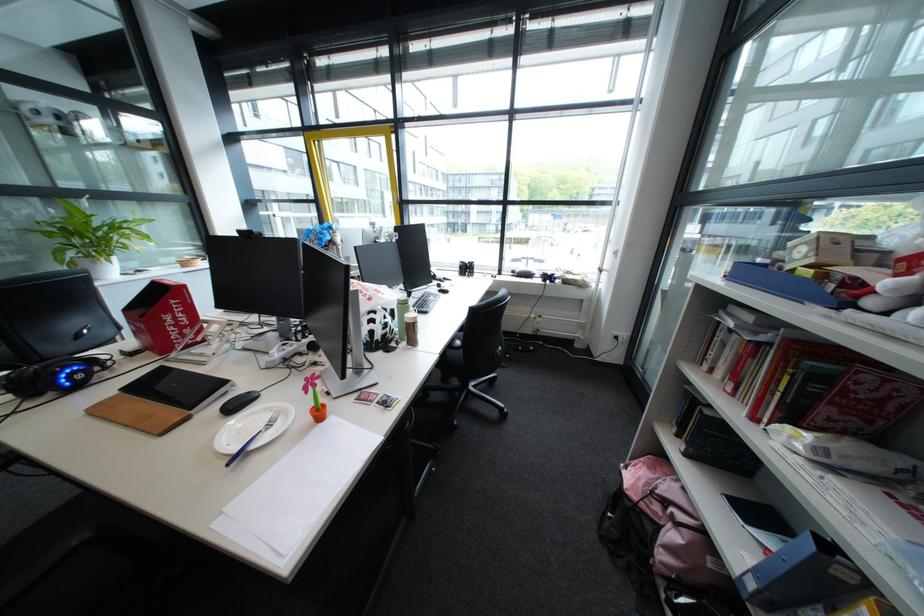
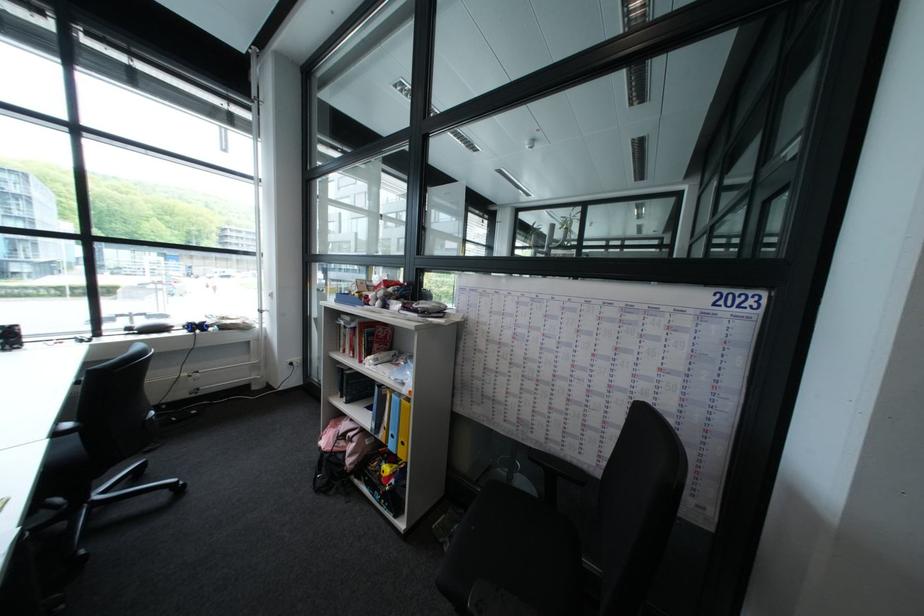
Question: Based on the continuous images, in which direction is the camera rotating? Reply with the corresponding letter.

Choices:
 (A) Left
 (B) Right
 (C) Up
 (D) Down

Answer: (B)